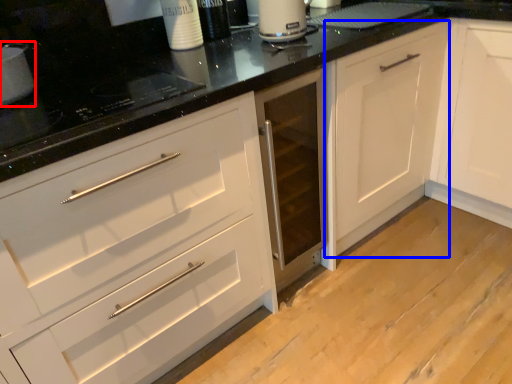
Question: Among these objects, which one is farthest to the camera, appliance (highlighted by a red box) or cabinetry (highlighted by a blue box)?

Choices:
 (A) appliance
 (B) cabinetry

Answer: (B)